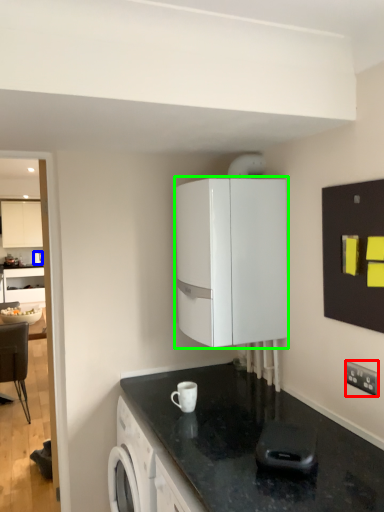
Question: Based on their relative distances, which object is nearer to electric outlet (highlighted by a red box)? Choose from kitchen appliance (highlighted by a blue box) and cabinetry (highlighted by a green box).

Choices:
 (A) kitchen appliance
 (B) cabinetry

Answer: (B)